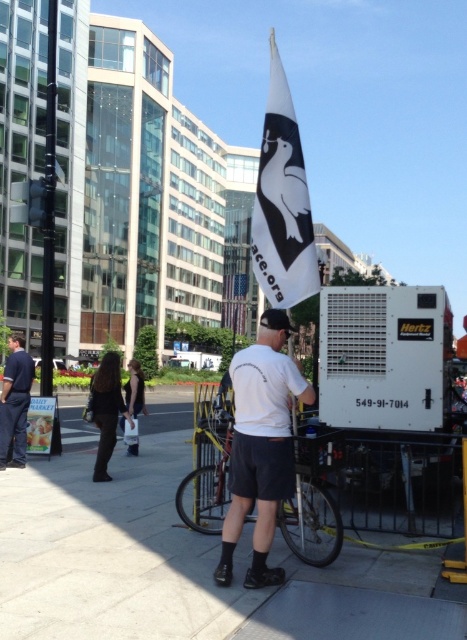
Question: Which point is farther to the camera?

Choices:
 (A) white cotton t-shirt at center
 (B) metallic silver bicycle at center
 (C) black fabric bag at center

Answer: (C)

Question: Which point is farther to the camera?

Choices:
 (A) white fabric flag at upper center
 (B) dark blue jeans at lower left

Answer: (B)

Question: Among these points, which one is nearest to the camera?

Choices:
 (A) (268, 529)
 (B) (112, 401)
 (C) (18, 362)
 (D) (175, 456)

Answer: (A)

Question: Does smooth concrete sidewalk at center appear on the right side of dark brown leather jacket at lower left?

Choices:
 (A) no
 (B) yes

Answer: (B)

Question: Can you confirm if white cotton t-shirt at center is positioned to the right of dark brown leather jacket at lower left?

Choices:
 (A) no
 (B) yes

Answer: (B)

Question: Does white cotton t-shirt at center lie behind dark brown leather jacket at lower left?

Choices:
 (A) no
 (B) yes

Answer: (A)